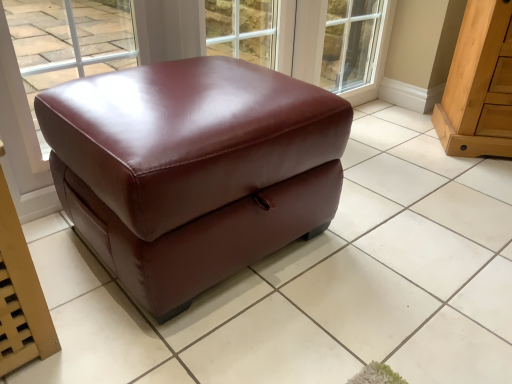
Question: In terms of height, does transparent glass window at upper center look taller or shorter compared to light brown wood drawer at right, which appears as the second furniture when viewed from the left?

Choices:
 (A) short
 (B) tall

Answer: (B)

Question: In the image, is transparent glass window at upper center positioned in front of or behind light brown wood drawer at right, placed as the 1th furniture when sorted from right to left?

Choices:
 (A) front
 (B) behind

Answer: (A)

Question: Estimate the real-world distances between objects in this image. Which object is farther from the light brown wood drawer at right, placed as the 1th furniture when sorted from right to left?

Choices:
 (A) satin brown leather ottoman at center, the 1th furniture from the left
 (B) transparent glass window at upper center

Answer: (B)

Question: Which object is the farthest from the satin brown leather ottoman at center, the 1th furniture from the left?

Choices:
 (A) light brown wood drawer at right, placed as the 1th furniture when sorted from right to left
 (B) transparent glass window at upper center

Answer: (B)